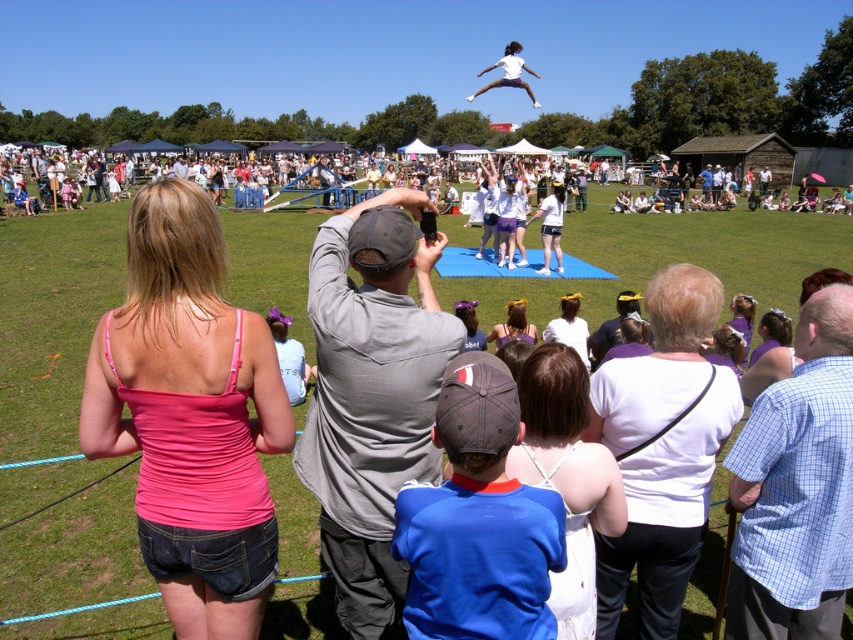
Is the position of dark gray baseball cap at center more distant than that of matte purple shirt at center?

No, it is not.

Does dark gray baseball cap at center have a smaller size compared to matte purple shirt at center?

Indeed, dark gray baseball cap at center has a smaller size compared to matte purple shirt at center.

Between point (465, 525) and point (456, 312), which one is positioned in front?

Point (465, 525) is in front.

This screenshot has height=640, width=853. I want to click on dark gray baseball cap at center, so click(x=479, y=520).

Which is below, gray cotton shirt at center or matte purple shirt at center?

gray cotton shirt at center is lower down.

Is point (335, 570) closer to camera compared to point (466, 308)?

Yes, point (335, 570) is closer to viewer.

The image size is (853, 640). In order to click on gray cotton shirt at center in this screenshot , I will do `click(370, 394)`.

Locate an element on the screen. dark gray baseball cap at center is located at coordinates (479, 520).

Who is lower down, dark gray baseball cap at center or white fabric dress at center?

Positioned lower is dark gray baseball cap at center.

What do you see at coordinates (479, 520) in the screenshot? The width and height of the screenshot is (853, 640). I see `dark gray baseball cap at center` at bounding box center [479, 520].

In order to click on dark gray baseball cap at center in this screenshot , I will do `click(479, 520)`.